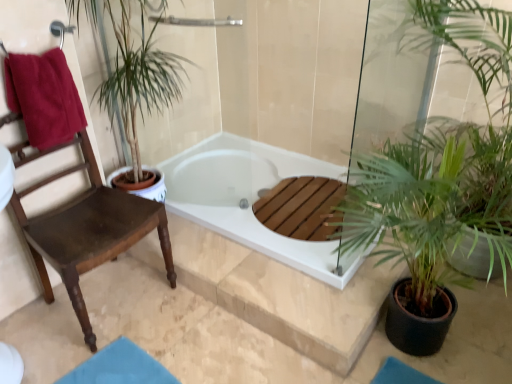
Question: From the image's perspective, does wooden chair at left appear higher than white glossy bathtub at center?

Choices:
 (A) yes
 (B) no

Answer: (B)

Question: From the image's perspective, is wooden chair at left beneath white glossy bathtub at center?

Choices:
 (A) yes
 (B) no

Answer: (A)

Question: Does wooden chair at left come in front of white glossy bathtub at center?

Choices:
 (A) yes
 (B) no

Answer: (A)

Question: Can we say wooden chair at left lies outside white glossy bathtub at center?

Choices:
 (A) no
 (B) yes

Answer: (B)

Question: Considering the relative sizes of wooden chair at left and white glossy bathtub at center in the image provided, is wooden chair at left smaller than white glossy bathtub at center?

Choices:
 (A) no
 (B) yes

Answer: (A)

Question: Is white glossy bathtub at center inside the boundaries of wooden chair at left, or outside?

Choices:
 (A) inside
 (B) outside

Answer: (B)

Question: From their relative heights in the image, would you say white glossy bathtub at center is taller or shorter than wooden chair at left?

Choices:
 (A) short
 (B) tall

Answer: (A)

Question: Is white glossy bathtub at center in front of or behind wooden chair at left in the image?

Choices:
 (A) front
 (B) behind

Answer: (B)

Question: Is point (166, 183) positioned closer to the camera than point (141, 208)?

Choices:
 (A) closer
 (B) farther

Answer: (B)

Question: From a real-world perspective, relative to white glossy bathtub at center, is maroon cotton towel at left vertically above or below?

Choices:
 (A) above
 (B) below

Answer: (A)

Question: Does point (64, 104) appear closer or farther from the camera than point (342, 173)?

Choices:
 (A) closer
 (B) farther

Answer: (A)

Question: Looking at the image, does maroon cotton towel at left seem bigger or smaller compared to white glossy bathtub at center?

Choices:
 (A) small
 (B) big

Answer: (A)

Question: In terms of height, does maroon cotton towel at left look taller or shorter compared to white glossy bathtub at center?

Choices:
 (A) short
 (B) tall

Answer: (B)

Question: Considering their positions, is wooden chair at left located in front of or behind white glossy bathtub at center?

Choices:
 (A) front
 (B) behind

Answer: (A)

Question: From their relative heights in the image, would you say wooden chair at left is taller or shorter than white glossy bathtub at center?

Choices:
 (A) tall
 (B) short

Answer: (A)